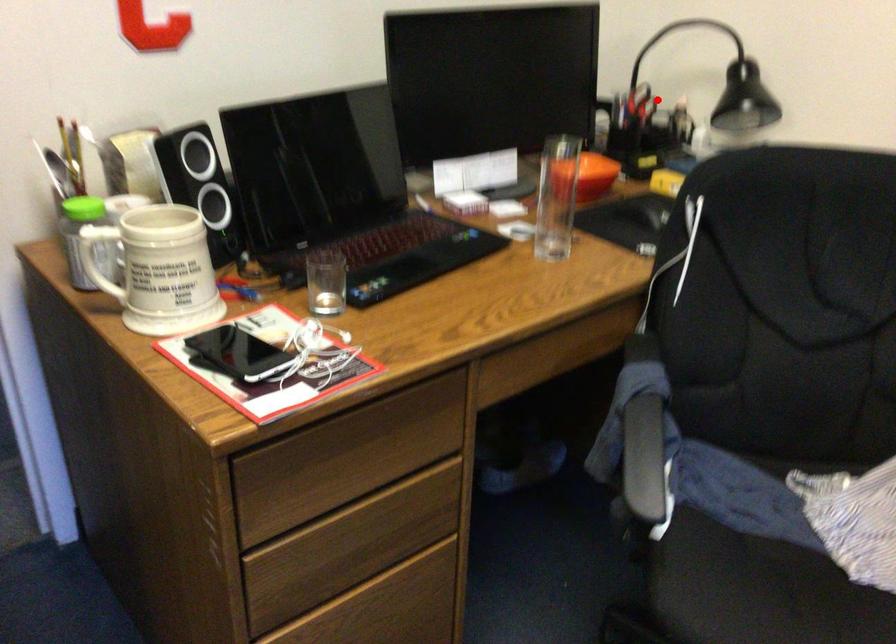
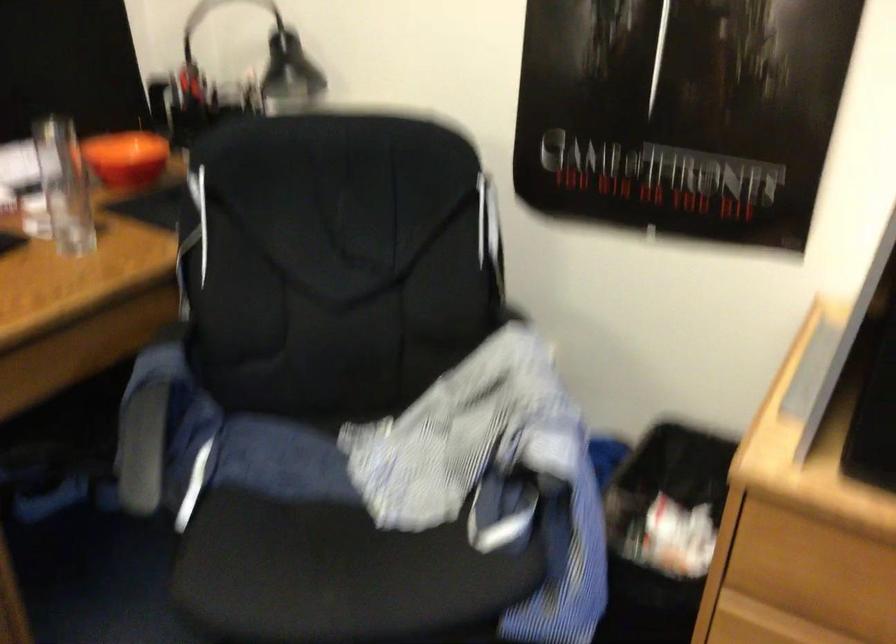
Find the pixel in the second image that matches the highlighted location in the first image.

(233, 82)